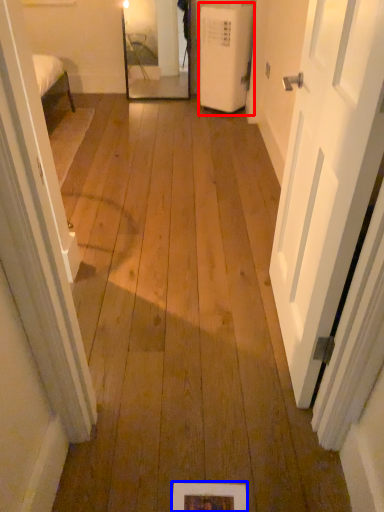
Question: Which point is further to the camera, air conditioner (highlighted by a red box) or picture frame (highlighted by a blue box)?

Choices:
 (A) air conditioner
 (B) picture frame

Answer: (A)